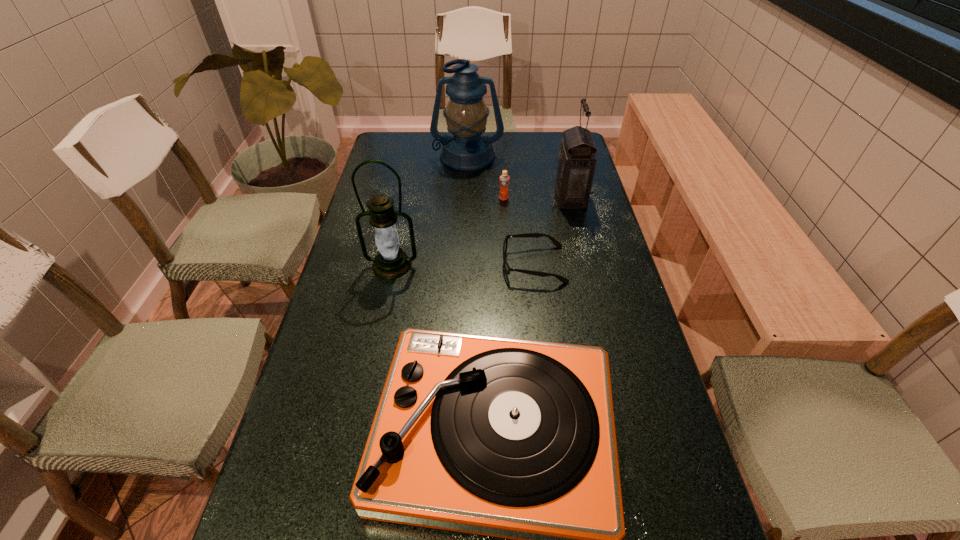
You are a GUI agent. You are given a task and a screenshot of the screen. Output one action in this format:
    pyautogui.click(x=<x>, y=<y>)
    Task: Click on the farthest lantern
    
    Given the screenshot: What is the action you would take?
    pyautogui.click(x=467, y=149)

This screenshot has width=960, height=540. In order to click on the nearest lantern in this screenshot , I will do `click(391, 262)`.

The height and width of the screenshot is (540, 960). What are the coordinates of `the second farthest lantern` in the screenshot? It's located at (576, 162).

Find the location of a particular element. the fifth tallest object is located at coordinates (504, 179).

Where is `the shortest object`? the shortest object is located at coordinates (535, 235).

Locate an element on the screen. This screenshot has width=960, height=540. vacant area situated 0.200m on the face of the farthest object is located at coordinates 466,204.

The height and width of the screenshot is (540, 960). In order to click on free region located on the side where the nearest lantern emits light in this screenshot , I will do click(383, 309).

Where is `blank area located 0.160m on the front-facing side of the second farthest lantern`? blank area located 0.160m on the front-facing side of the second farthest lantern is located at coordinates (507, 198).

The image size is (960, 540). In order to click on free location located on the front-facing side of the second farthest lantern in this screenshot , I will do [x=498, y=198].

This screenshot has width=960, height=540. I want to click on vacant space located 0.120m on the front-facing side of the second farthest lantern, so click(518, 198).